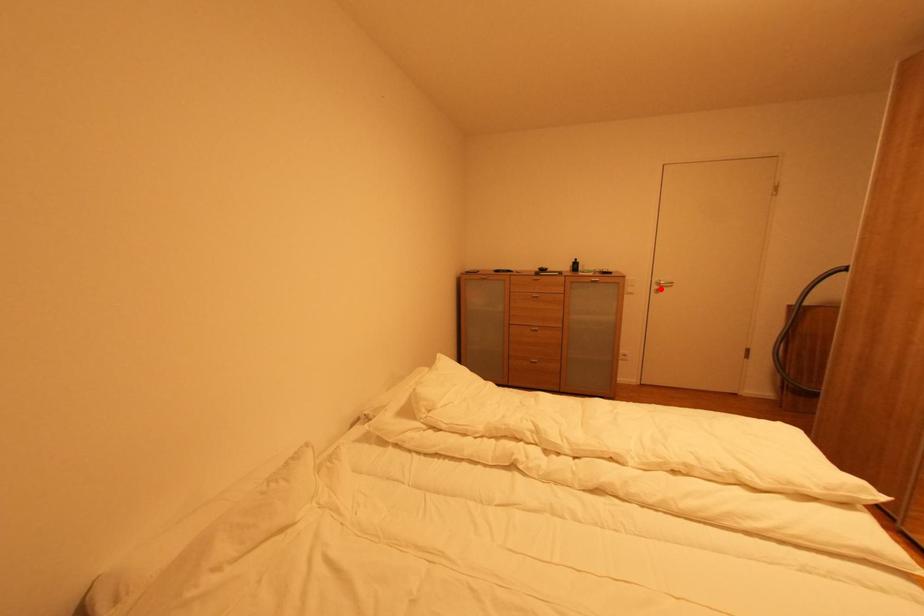
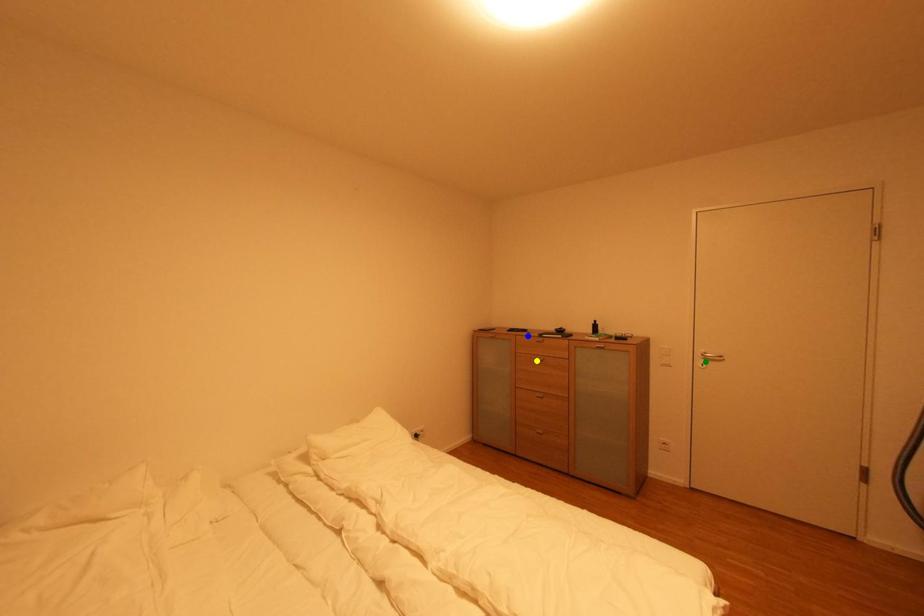
Question: I am providing you with two images of the same scene from different viewpoints. A red point is marked on the first image. You are given multiple points on the second image. Which point in image 2 represents the same 3d spot as the red point in image 1?

Choices:
 (A) yellow point
 (B) blue point
 (C) green point

Answer: (C)